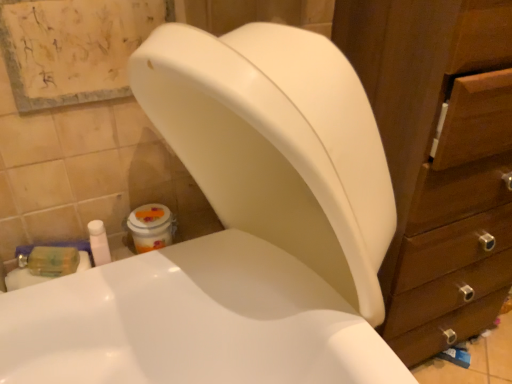
Question: From a real-world perspective, is wooden cabinet at right under white plastic bottle at lower left?

Choices:
 (A) yes
 (B) no

Answer: (A)

Question: From a real-world perspective, is wooden cabinet at right located higher than white plastic bottle at lower left?

Choices:
 (A) no
 (B) yes

Answer: (A)

Question: Does wooden cabinet at right come in front of white plastic bottle at lower left?

Choices:
 (A) no
 (B) yes

Answer: (B)

Question: Considering the relative sizes of wooden cabinet at right and white plastic bottle at lower left in the image provided, is wooden cabinet at right thinner than white plastic bottle at lower left?

Choices:
 (A) no
 (B) yes

Answer: (A)

Question: Is wooden cabinet at right behind white plastic bottle at lower left?

Choices:
 (A) no
 (B) yes

Answer: (A)

Question: Is wooden cabinet at right looking in the opposite direction of white plastic bottle at lower left?

Choices:
 (A) yes
 (B) no

Answer: (B)

Question: Is white plastic bottle at lower left far away from wooden cabinet at right?

Choices:
 (A) no
 (B) yes

Answer: (A)

Question: Is white plastic bottle at lower left to the left of wooden cabinet at right from the viewer's perspective?

Choices:
 (A) no
 (B) yes

Answer: (B)

Question: Does white plastic bottle at lower left have a smaller size compared to wooden cabinet at right?

Choices:
 (A) no
 (B) yes

Answer: (B)

Question: From a real-world perspective, is white plastic bottle at lower left located beneath wooden cabinet at right?

Choices:
 (A) no
 (B) yes

Answer: (A)

Question: Is white plastic bottle at lower left positioned in front of wooden cabinet at right?

Choices:
 (A) no
 (B) yes

Answer: (A)

Question: From the image's perspective, does white plastic bottle at lower left appear lower than wooden cabinet at right?

Choices:
 (A) no
 (B) yes

Answer: (B)

Question: From a real-world perspective, is white plastic bottle at lower left positioned above or below wooden cabinet at right?

Choices:
 (A) above
 (B) below

Answer: (A)